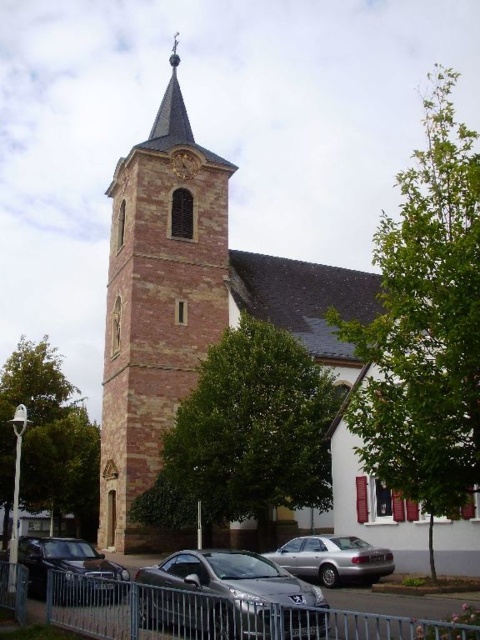
You are standing in front of the church and want to walk towards the metallic clock at upper center. Which direction should you look to see the metallic silver fence at lower center?

The metallic silver fence at lower center is below the metallic clock at upper center, so you should look downward to see the metallic silver fence at lower center.